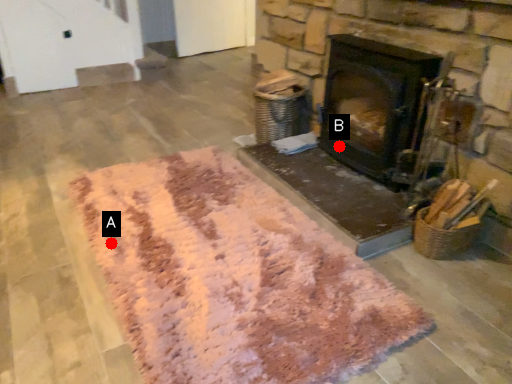
Question: Two points are circled on the image, labeled by A and B beside each circle. Which point appears closest to the camera in this image?

Choices:
 (A) A is closer
 (B) B is closer

Answer: (A)